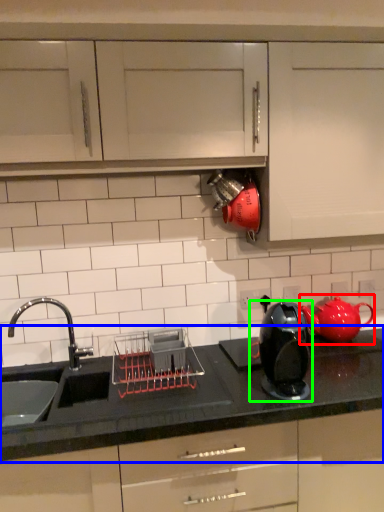
Question: Based on their relative distances, which object is farther from tea pot (highlighted by a red box)? Choose from countertop (highlighted by a blue box) and home appliance (highlighted by a green box).

Choices:
 (A) countertop
 (B) home appliance

Answer: (B)